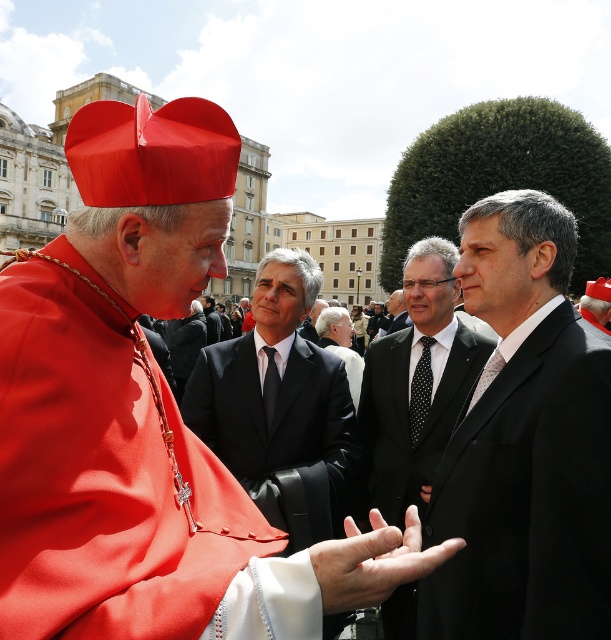
Which is more to the left, black suit at center or dark gray suit at center?

Positioned to the left is dark gray suit at center.

Does black suit at center lie in front of dark gray suit at center?

Yes, it is.

Who is more forward, (557, 406) or (335, 353)?

Positioned in front is point (557, 406).

I want to click on black suit at center, so click(524, 442).

Based on the photo, who is more forward, (229,160) or (340,330)?

Positioned in front is point (229,160).

Image resolution: width=611 pixels, height=640 pixels. What do you see at coordinates (145, 417) in the screenshot?
I see `matte red hat at upper left` at bounding box center [145, 417].

Is point (86, 477) closer to camera compared to point (338, 320)?

That is True.

The height and width of the screenshot is (640, 611). I want to click on matte red hat at upper left, so click(x=145, y=417).

Which is above, black suit at center or black satin suit at center?

Positioned higher is black suit at center.

Does black suit at center appear on the right side of black satin suit at center?

Yes, black suit at center is to the right of black satin suit at center.

Locate an element on the screen. The width and height of the screenshot is (611, 640). black suit at center is located at coordinates (524, 442).

This screenshot has width=611, height=640. What are the coordinates of `black suit at center` in the screenshot? It's located at [524, 442].